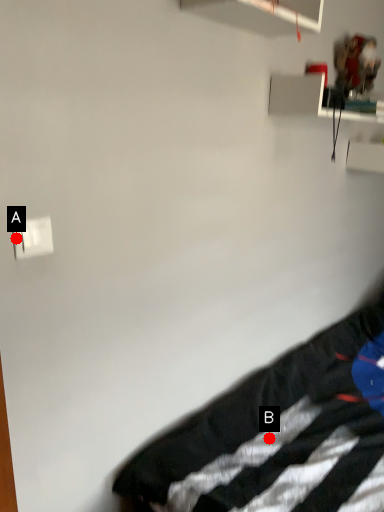
Question: Two points are circled on the image, labeled by A and B beside each circle. Which point is closer to the camera taking this photo?

Choices:
 (A) A is closer
 (B) B is closer

Answer: (A)